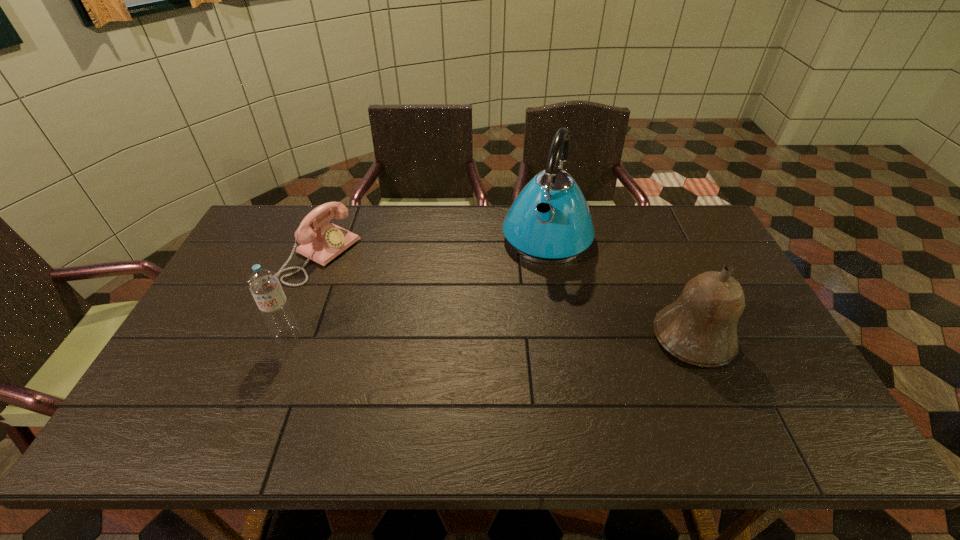
Locate an element on the screen. water bottle is located at coordinates (264, 284).

Where is `bell`? The height and width of the screenshot is (540, 960). bell is located at coordinates (700, 327).

The height and width of the screenshot is (540, 960). Find the location of `the shortest object`. the shortest object is located at coordinates (326, 241).

In order to click on kettle in this screenshot , I will do `click(549, 222)`.

The height and width of the screenshot is (540, 960). I want to click on the tallest object, so click(x=549, y=222).

Find the location of `vacant space situated on the back of the water bottle`. vacant space situated on the back of the water bottle is located at coordinates (325, 241).

Identify the location of vacant point located 0.390m on the left of the bell. [509, 338].

This screenshot has height=540, width=960. Identify the location of free space located 0.050m on the dial of the telephone. (357, 278).

Locate an element on the screen. The height and width of the screenshot is (540, 960). vacant area situated on the dial of the telephone is located at coordinates (368, 283).

Find the location of a particular element. This screenshot has width=960, height=540. free point located 0.320m on the dial of the telephone is located at coordinates (427, 314).